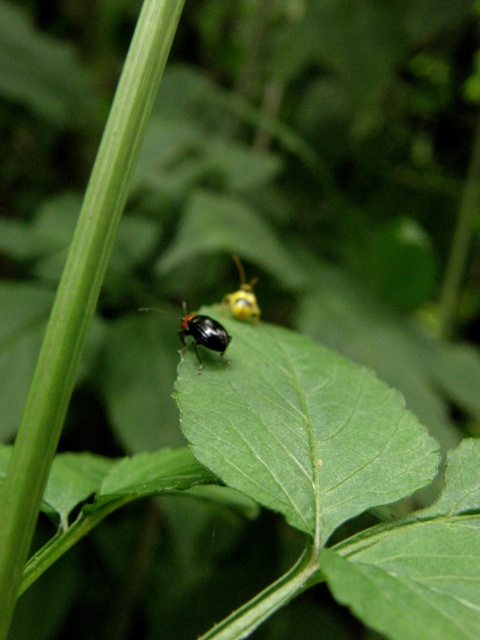
Question: Can you confirm if black glossy beetle at center is bigger than yellow matte leaf beetle at center?

Choices:
 (A) yes
 (B) no

Answer: (B)

Question: Which point is closer to the camera?

Choices:
 (A) yellow matte leaf beetle at center
 (B) black glossy beetle at center

Answer: (B)

Question: Does black glossy beetle at center appear under yellow matte leaf beetle at center?

Choices:
 (A) yes
 (B) no

Answer: (A)

Question: Is black glossy beetle at center bigger than yellow matte leaf beetle at center?

Choices:
 (A) yes
 (B) no

Answer: (B)